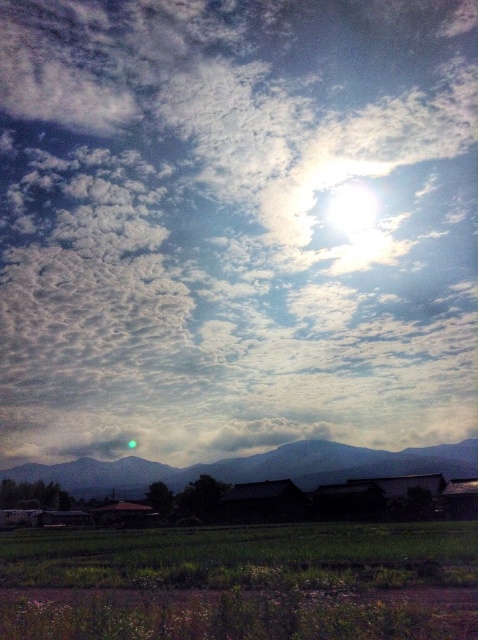
Question: Does white fluffy cloud at upper center appear on the left side of green grassy rice field at lower center?

Choices:
 (A) yes
 (B) no

Answer: (A)

Question: Does green grassy rice field at lower center have a smaller size compared to dark gray mountain at center?

Choices:
 (A) no
 (B) yes

Answer: (A)

Question: Among these objects, which one is farthest from the camera?

Choices:
 (A) green grassy rice field at lower center
 (B) white fluffy cloud at upper center
 (C) dark gray mountain at center

Answer: (B)

Question: Which object is farther from the camera taking this photo?

Choices:
 (A) dark gray mountain at center
 (B) white fluffy cloud at upper center
 (C) green grassy rice field at lower center

Answer: (B)

Question: Which point is farther to the camera?

Choices:
 (A) white fluffy cloud at upper center
 (B) green grassy rice field at lower center
 (C) dark gray mountain at center

Answer: (A)

Question: Can you confirm if green grassy rice field at lower center is positioned above dark gray mountain at center?

Choices:
 (A) no
 (B) yes

Answer: (B)